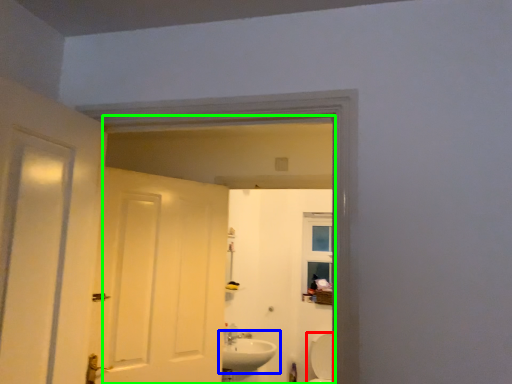
Question: Considering the real-world distances, which object is closest to bath (highlighted by a red box)? sink (highlighted by a blue box) or mirror (highlighted by a green box).

Choices:
 (A) sink
 (B) mirror

Answer: (B)